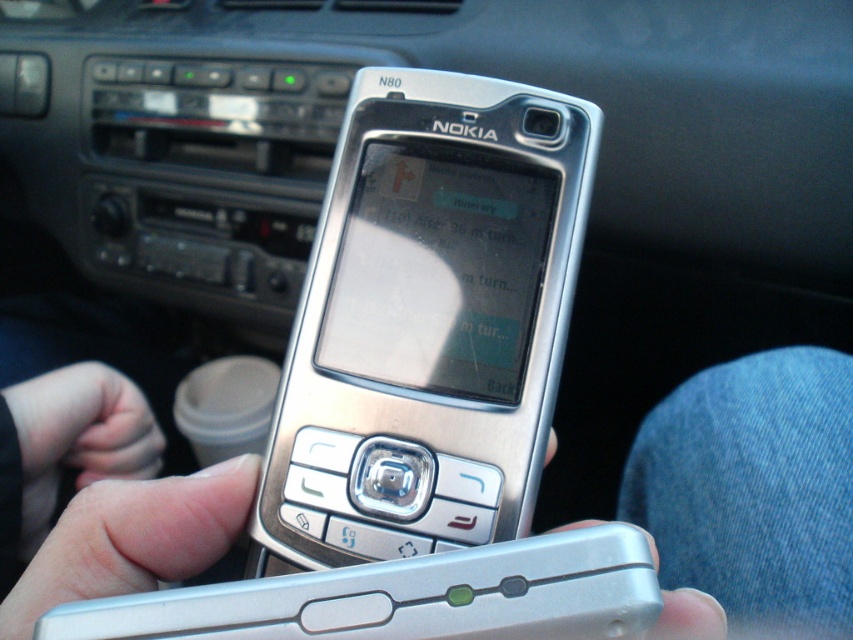
Who is shorter, silver metallic nokia phone at center or silver metallic phone at center?

Standing shorter between the two is silver metallic phone at center.

Is silver metallic nokia phone at center to the right of silver metallic phone at center from the viewer's perspective?

No, silver metallic nokia phone at center is not to the right of silver metallic phone at center.

Find the location of `silver metallic nokia phone at center`. silver metallic nokia phone at center is located at coordinates (427, 323).